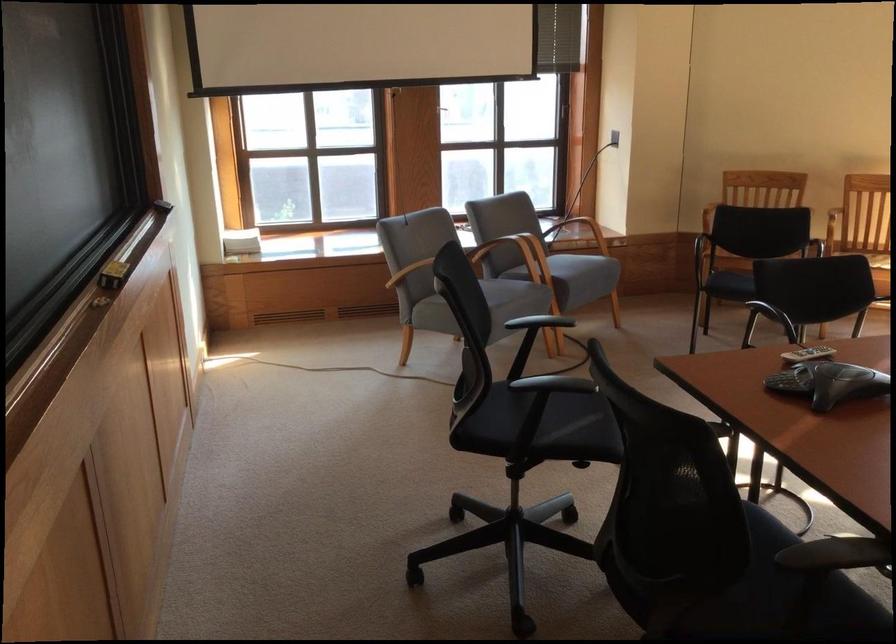
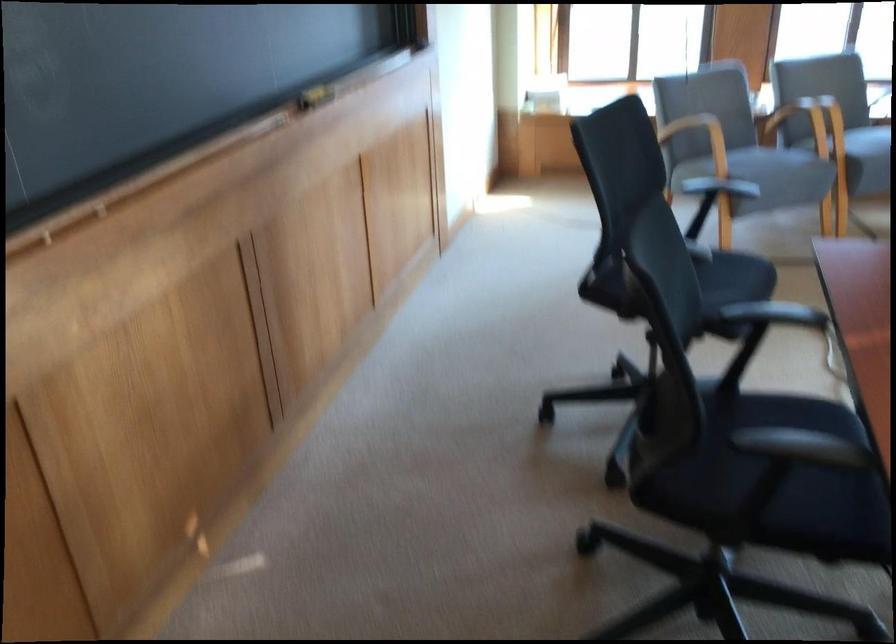
Locate, in the second image, the point that corresponds to (x=509, y=303) in the first image.

(769, 172)